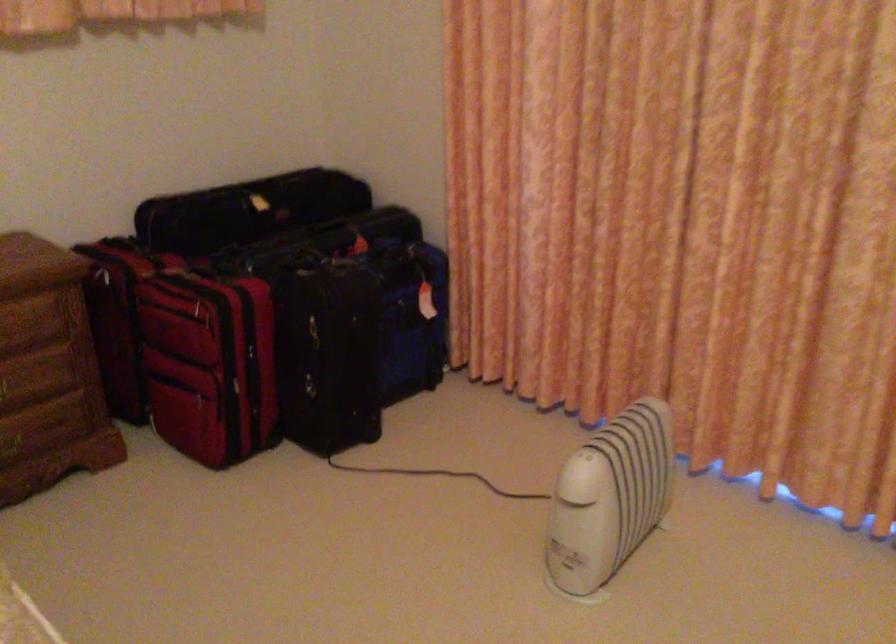
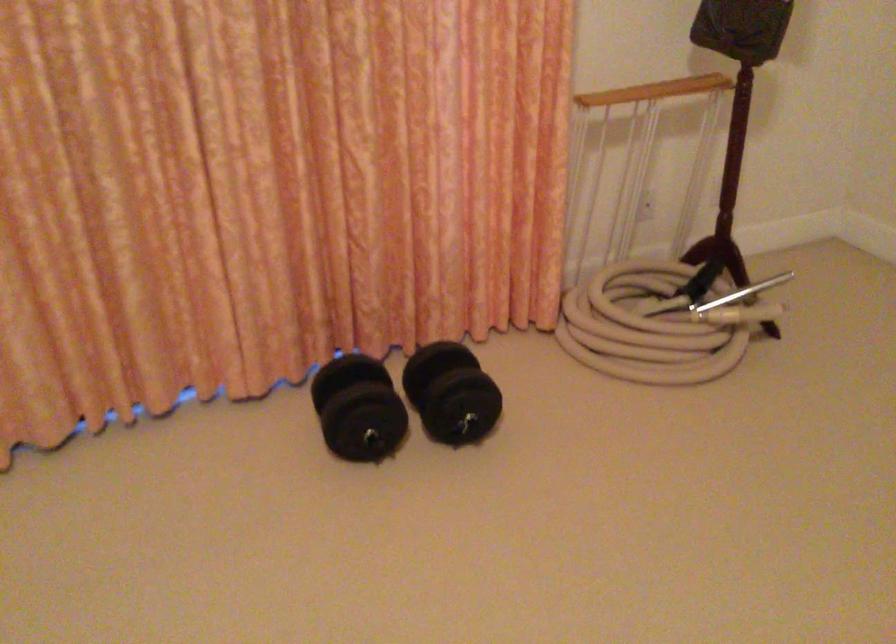
Based on the continuous images, in which direction is the camera rotating?

The rotation direction of the camera is right-down.